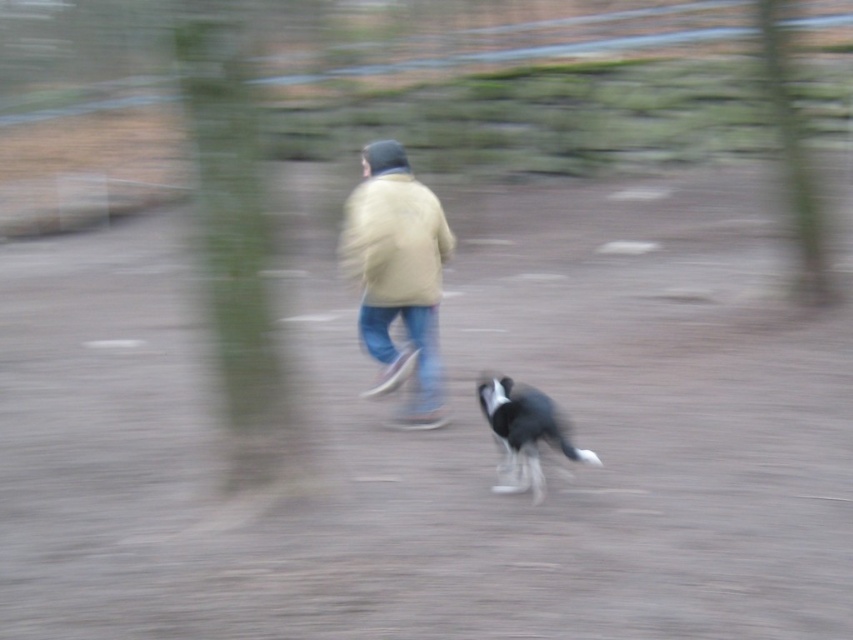
Question: Which object is positioned closest to the light beige jacket at center?

Choices:
 (A) green leafy tree at upper center
 (B) black and white fur dog at lower center

Answer: (B)

Question: Which point appears closest to the camera in this image?

Choices:
 (A) (392, 227)
 (B) (476, 394)

Answer: (A)

Question: Can you confirm if green textured tree at upper right is wider than black and white fur dog at lower center?

Choices:
 (A) yes
 (B) no

Answer: (B)

Question: In this image, where is light yellow jacket at center located relative to light beige jacket at center?

Choices:
 (A) right
 (B) left

Answer: (B)

Question: Which object is positioned closest to the light beige jacket at center?

Choices:
 (A) green textured tree at upper right
 (B) black and white fur dog at lower center

Answer: (B)

Question: Where is green leafy tree at upper center located in relation to black and white fur dog at lower center in the image?

Choices:
 (A) below
 (B) above

Answer: (B)